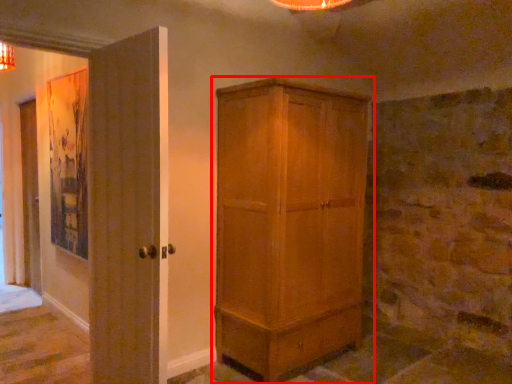
Question: From the image's perspective, where is cupboard (annotated by the red box) located relative to door?

Choices:
 (A) above
 (B) below

Answer: (B)